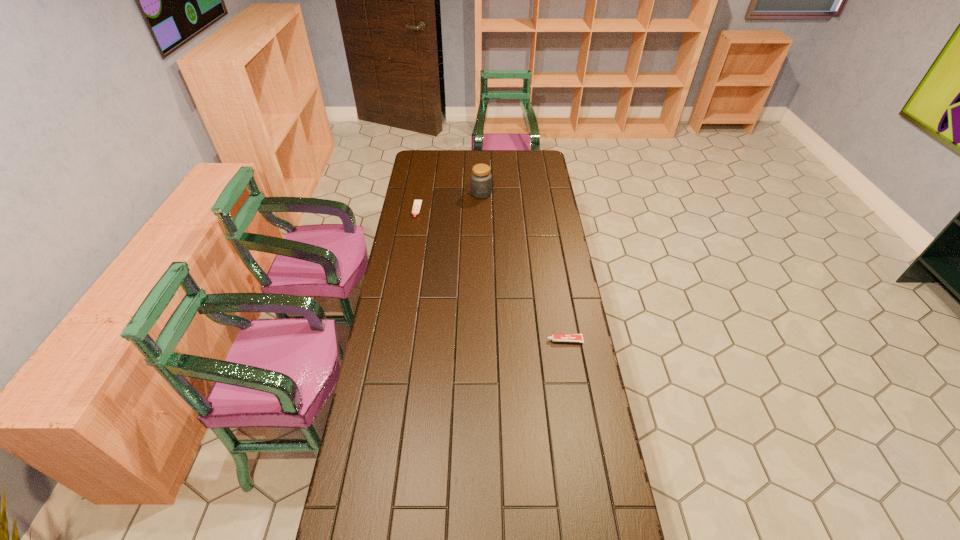
You are a GUI agent. You are given a task and a screenshot of the screen. Output one action in this format:
    pyautogui.click(x=<x>, y=<y>)
    Task: Click on the free point located at the nozzle of the right toothpaste
    
    Given the screenshot: What is the action you would take?
    pyautogui.click(x=460, y=340)

Identify the location of object that is at the left edge. The height and width of the screenshot is (540, 960). (417, 203).

I want to click on object that is at the right edge, so point(555,337).

At what (x,y) coordinates should I click in order to perform the action: click on vacant area at the far edge. Please return your answer as a coordinate pair (x, y). Looking at the image, I should click on (478, 161).

The height and width of the screenshot is (540, 960). In the image, there is a desktop. In order to click on free region at the left edge in this screenshot , I will do `click(419, 277)`.

Find the location of `free region at the right edge of the desktop`. free region at the right edge of the desktop is located at coordinates (555, 225).

At what (x,y) coordinates should I click in order to perform the action: click on vacant space at the far left corner of the desktop. Please return your answer as a coordinate pair (x, y). Looking at the image, I should click on (438, 164).

Find the location of a particular element. vacant space that is in between the farthest object and the farther toothpaste is located at coordinates (449, 202).

Locate an element on the screen. Image resolution: width=960 pixels, height=540 pixels. vacant region between the farthest object and the second farthest object is located at coordinates (449, 202).

The height and width of the screenshot is (540, 960). In order to click on free space between the farthest object and the farther toothpaste in this screenshot , I will do [x=449, y=202].